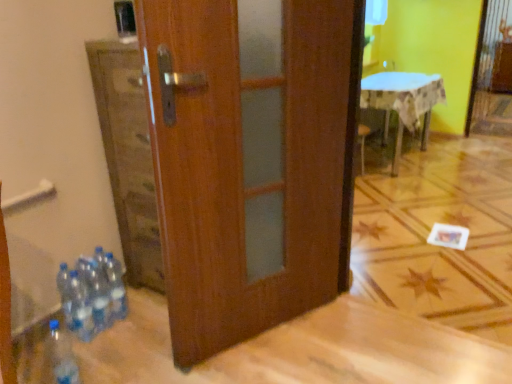
You are a GUI agent. You are given a task and a screenshot of the screen. Output one action in this format:
    pyautogui.click(x=<x>, y=<y>)
    Task: Click on the free space in front of clear plastic bottles at lower left, acting as the 1th bottle starting from the back
    
    Given the screenshot: What is the action you would take?
    pyautogui.click(x=118, y=337)